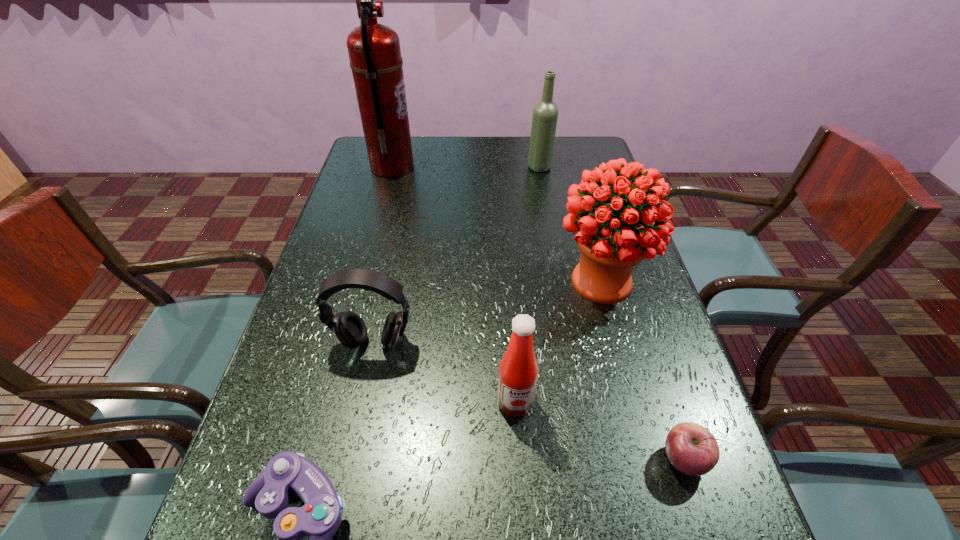
Identify the location of fire extinguisher. (374, 51).

The image size is (960, 540). I want to click on the third farthest object, so click(611, 243).

This screenshot has width=960, height=540. In order to click on wine bottle in this screenshot , I will do `click(545, 113)`.

You are a GUI agent. You are given a task and a screenshot of the screen. Output one action in this format:
    pyautogui.click(x=<x>, y=<y>)
    Task: Click on the fourth shortest object
    Image resolution: width=960 pixels, height=540 pixels.
    Given the screenshot: What is the action you would take?
    pyautogui.click(x=518, y=371)

The width and height of the screenshot is (960, 540). I want to click on condiment, so click(x=518, y=371).

Locate an element on the screen. The image size is (960, 540). the fourth nearest object is located at coordinates (349, 328).

The height and width of the screenshot is (540, 960). Identify the location of the fifth tallest object. (349, 328).

The width and height of the screenshot is (960, 540). What are the coordinates of `the second shortest object` in the screenshot? It's located at (692, 449).

At what (x,y) coordinates should I click in order to perform the action: click on vacant region located 0.330m on the nozzle side of the tallest object. Please return your answer as a coordinate pair (x, y). Image resolution: width=960 pixels, height=540 pixels. Looking at the image, I should click on (513, 167).

This screenshot has width=960, height=540. I want to click on blank space located on the back of the third farthest object, so click(x=585, y=220).